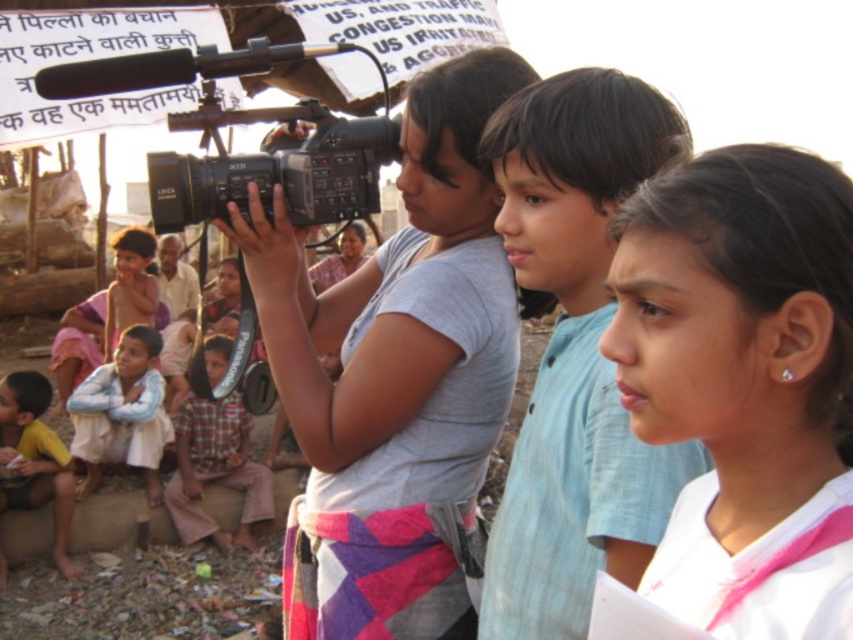
Can you confirm if white fabric at center is positioned below black plastic video camera at upper left?

Yes, white fabric at center is below black plastic video camera at upper left.

Is white fabric at center positioned in front of black plastic video camera at upper left?

Yes, it is.

What do you see at coordinates (744, 385) in the screenshot? The image size is (853, 640). I see `white fabric at center` at bounding box center [744, 385].

Where is `white fabric at center`? white fabric at center is located at coordinates (744, 385).

Between black plastic video camera at upper left and plaid fabric shirt at lower left, which one appears on the right side from the viewer's perspective?

black plastic video camera at upper left

Which of these two, black plastic video camera at upper left or plaid fabric shirt at lower left, stands taller?

Standing taller between the two is black plastic video camera at upper left.

Image resolution: width=853 pixels, height=640 pixels. Describe the element at coordinates (242, 124) in the screenshot. I see `black plastic video camera at upper left` at that location.

Locate an element on the screen. black plastic video camera at upper left is located at coordinates (242, 124).

Does light blue cotton shirt at center have a lesser width compared to plaid fabric shirt at lower left?

Indeed, light blue cotton shirt at center has a lesser width compared to plaid fabric shirt at lower left.

Image resolution: width=853 pixels, height=640 pixels. In order to click on light blue cotton shirt at center in this screenshot , I will do `click(573, 355)`.